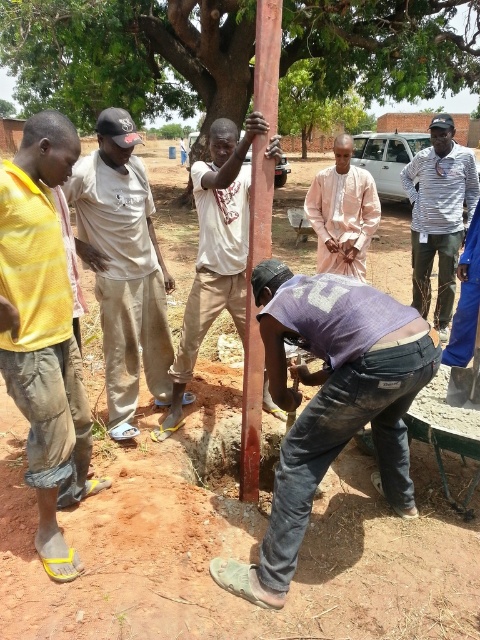
Question: Which of the following is the closest to the observer?

Choices:
 (A) yellow mesh shirt at left
 (B) light pink fabric at center

Answer: (A)

Question: Which of these objects is positioned closest to the striped shirt at upper right?

Choices:
 (A) smooth brown pole at center
 (B) smooth wood pole at center

Answer: (A)

Question: Considering the relative positions of light brown cotton shirt at center and striped shirt at upper right in the image provided, where is light brown cotton shirt at center located with respect to striped shirt at upper right?

Choices:
 (A) below
 (B) above

Answer: (A)

Question: Is brown wood pole at center positioned at the back of light pink fabric at center?

Choices:
 (A) no
 (B) yes

Answer: (A)

Question: Which point is closer to the camera?

Choices:
 (A) light brown cotton shirt at center
 (B) light pink fabric at center

Answer: (A)

Question: Does yellow mesh shirt at left have a lesser width compared to striped shirt at upper right?

Choices:
 (A) no
 (B) yes

Answer: (B)